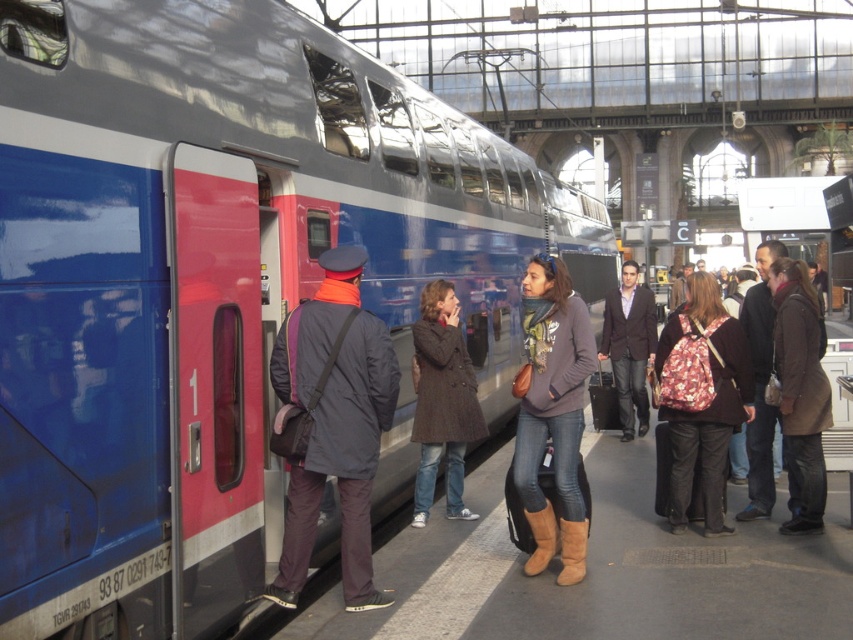
You are a passenger trying to locate your luggage. You see a brown wool coat at center and a dark brown leather jacket at center. Which item is covering the other one?

The brown wool coat at center is positioned over the dark brown leather jacket at center, so it is covering it.

You are a passenger at the train station and you see two coats hanging on a rack between the brown wool coat at center and the dark brown leather jacket at center. Which coat is taller?

The brown wool coat at center is taller than the dark brown leather jacket at center.